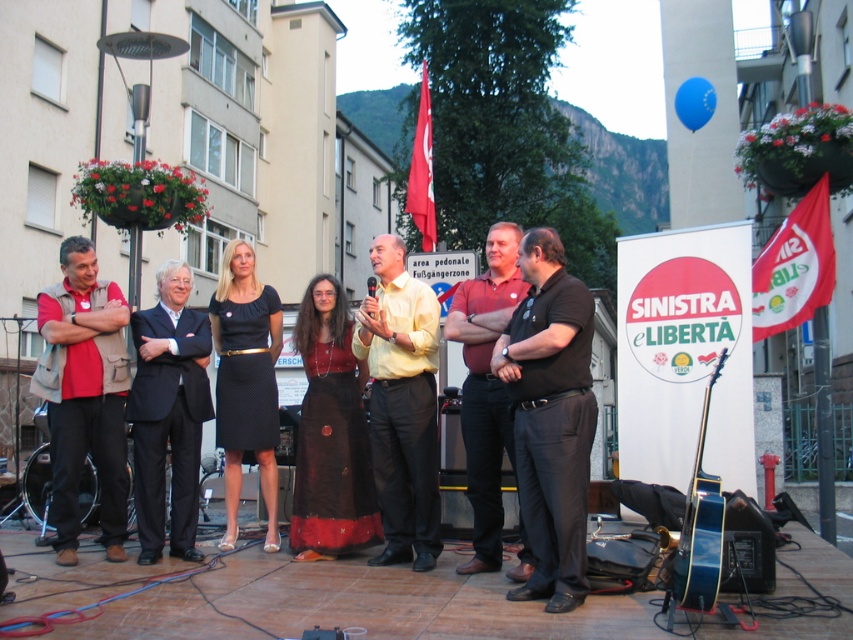
Question: From the image, what is the correct spatial relationship of yellow matte shirt at center in relation to black suit at center?

Choices:
 (A) right
 (B) left

Answer: (A)

Question: Among these points, which one is farthest from the camera?

Choices:
 (A) click(x=525, y=509)
 (B) click(x=177, y=426)

Answer: (B)

Question: Does matte red vest at left appear over black satin dress at center?

Choices:
 (A) no
 (B) yes

Answer: (A)

Question: Considering the real-world distances, which object is closest to the black suit at center?

Choices:
 (A) matte red shirt at center
 (B) black satin dress at center
 (C) yellow matte shirt at center

Answer: (B)

Question: Which is farther from the matte red vest at left?

Choices:
 (A) black suit at center
 (B) matte red shirt at center
 (C) yellow matte shirt at center

Answer: (B)

Question: Does black smooth shirt at center have a lesser width compared to blue glossy guitar at center right?

Choices:
 (A) yes
 (B) no

Answer: (A)